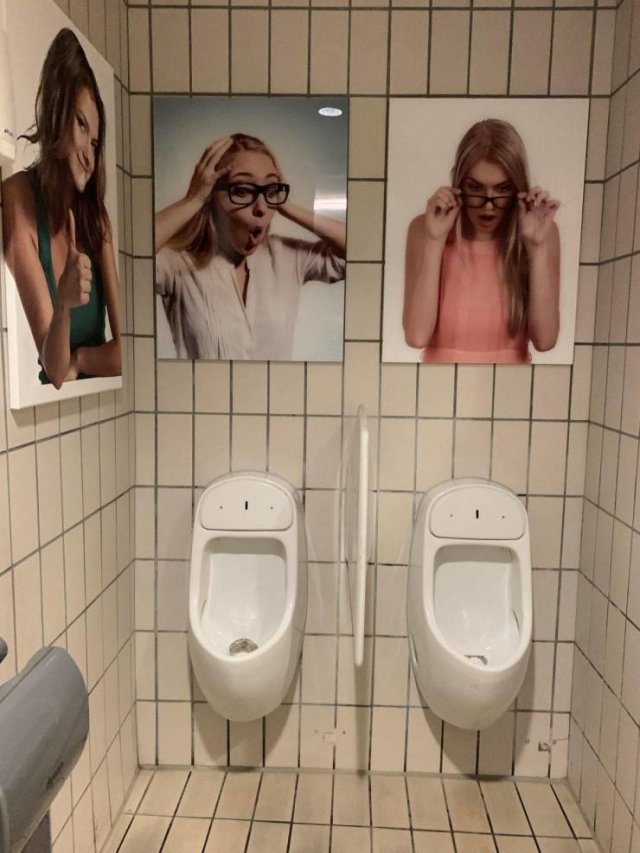
At what (x,y) coordinates should I click in order to perform the action: click on urinal. Please return your answer as a coordinate pair (x, y). Looking at the image, I should click on (248, 588), (472, 599).